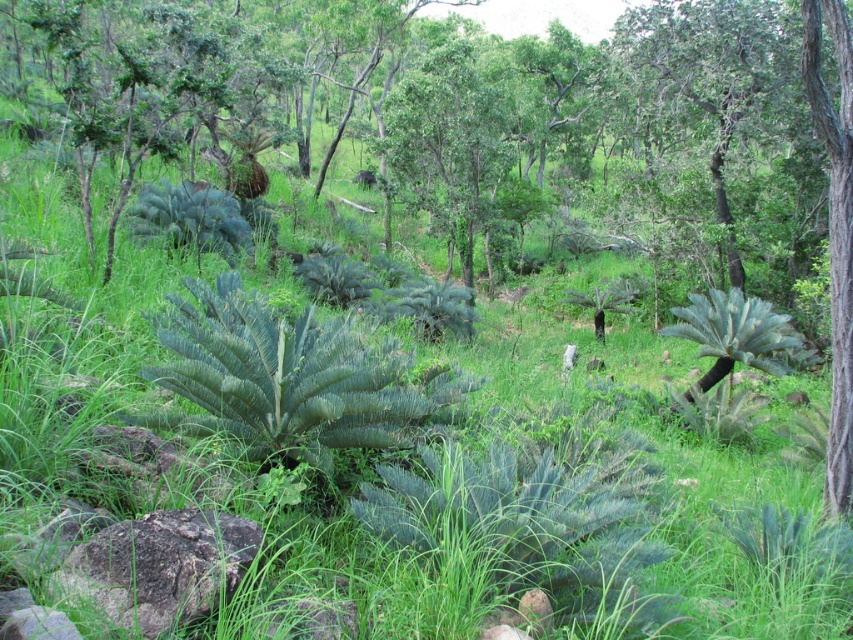
Question: From the image, what is the correct spatial relationship of green fibrous fern at center in relation to gray rough rock at lower left?

Choices:
 (A) above
 (B) below

Answer: (A)

Question: Does green fibrous fern at center have a smaller size compared to gray rough rock at lower left?

Choices:
 (A) yes
 (B) no

Answer: (B)

Question: Can you confirm if green fibrous fern at center is positioned above gray rough rock at lower left?

Choices:
 (A) yes
 (B) no

Answer: (A)